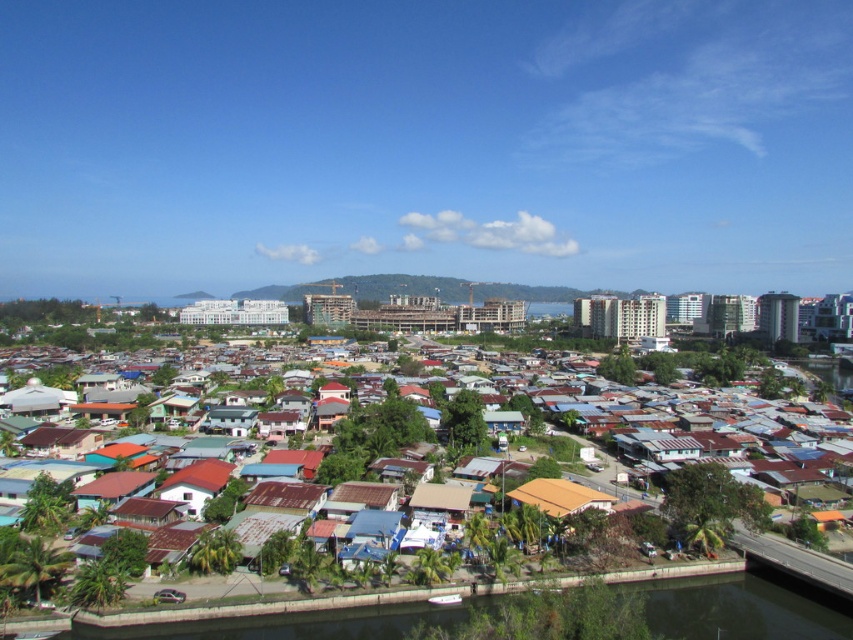
Question: Among these points, which one is farthest from the camera?

Choices:
 (A) (549, 500)
 (B) (848, 445)

Answer: (B)

Question: Does rusty corrugated metal hut at center appear over brown corrugated metal hut at center?

Choices:
 (A) yes
 (B) no

Answer: (A)

Question: Which of the following is the farthest from the observer?

Choices:
 (A) brown corrugated metal hut at center
 (B) rusty corrugated metal hut at center

Answer: (A)

Question: Is rusty corrugated metal hut at center bigger than brown corrugated metal hut at center?

Choices:
 (A) no
 (B) yes

Answer: (B)

Question: In this image, where is rusty corrugated metal hut at center located relative to brown corrugated metal hut at center?

Choices:
 (A) above
 (B) below

Answer: (A)